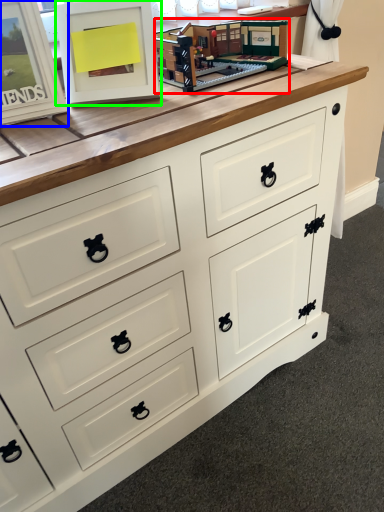
Question: Considering the real-world distances, which object is farthest from toy (highlighted by a red box)? picture frame (highlighted by a blue box) or picture frame (highlighted by a green box)?

Choices:
 (A) picture frame
 (B) picture frame

Answer: (A)